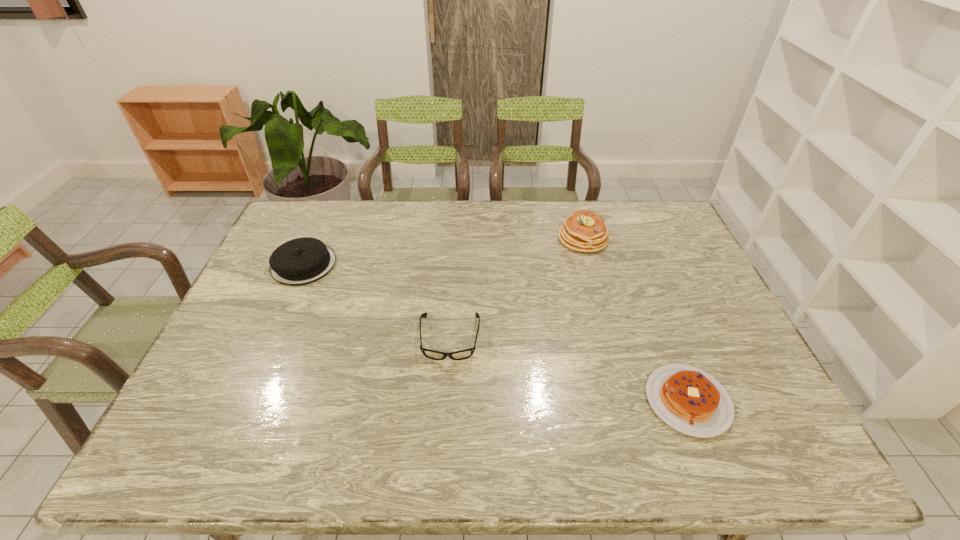
I want to click on free area in between the tallest object and the shortest object, so click(636, 320).

The height and width of the screenshot is (540, 960). Identify the location of vacant area between the tallest pancake and the shortest pancake. (636, 320).

Find the location of a particular element. vacant space in between the tallest pancake and the shortest pancake is located at coordinates (636, 320).

At what (x,y) coordinates should I click in order to perform the action: click on free space between the leftmost pancake and the second nearest object. Please return your answer as a coordinate pair (x, y). The image size is (960, 540). Looking at the image, I should click on (377, 301).

Find the location of a particular element. This screenshot has width=960, height=540. unoccupied position between the tallest pancake and the third farthest object is located at coordinates point(516,288).

Locate an element on the screen. This screenshot has height=540, width=960. unoccupied position between the tallest object and the third farthest object is located at coordinates (516, 288).

In order to click on free point between the third farthest object and the tallest object in this screenshot , I will do `click(516, 288)`.

I want to click on blank region between the nearest pancake and the second object from left to right, so click(569, 369).

You are a GUI agent. You are given a task and a screenshot of the screen. Output one action in this format:
    pyautogui.click(x=<x>, y=<y>)
    Task: Click on the free space between the tallest pancake and the second tallest object
    The height and width of the screenshot is (540, 960).
    Given the screenshot: What is the action you would take?
    pyautogui.click(x=444, y=251)

At what (x,y) coordinates should I click in order to perform the action: click on free space between the leftmost pancake and the third object from right to left. Please return your answer as a coordinate pair (x, y). This screenshot has width=960, height=540. Looking at the image, I should click on (377, 301).